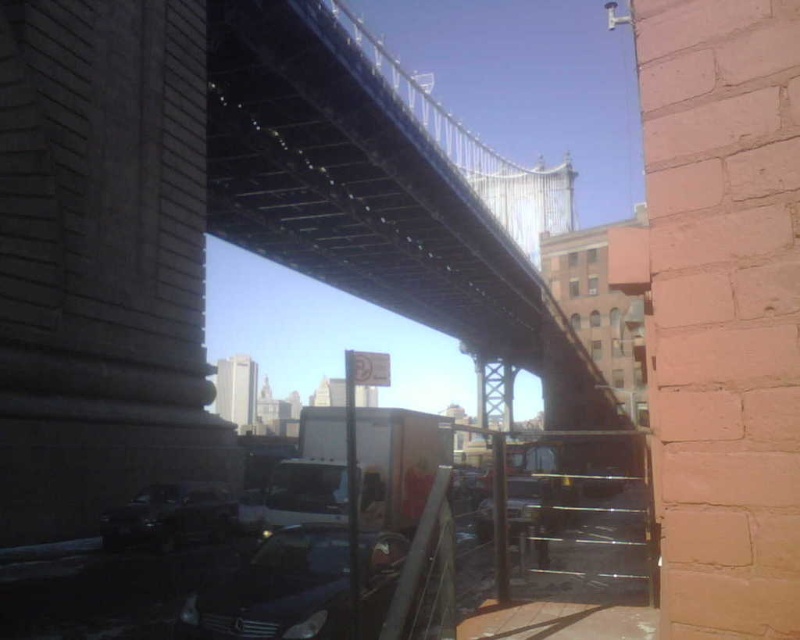
Is shiny black car at lower left to the right of metallic silver car at center from the viewer's perspective?

Incorrect, shiny black car at lower left is not on the right side of metallic silver car at center.

What do you see at coordinates (172, 516) in the screenshot? Image resolution: width=800 pixels, height=640 pixels. I see `shiny black car at lower left` at bounding box center [172, 516].

What are the coordinates of `shiny black car at lower left` in the screenshot? It's located at (172, 516).

Who is shorter, shiny black car at lower center or metallic silver car at center?

metallic silver car at center is shorter.

Is shiny black car at lower center behind metallic silver car at center?

No, it is not.

What do you see at coordinates (276, 589) in the screenshot? This screenshot has height=640, width=800. I see `shiny black car at lower center` at bounding box center [276, 589].

Where is `shiny black car at lower center`? Image resolution: width=800 pixels, height=640 pixels. shiny black car at lower center is located at coordinates (276, 589).

Is point (222, 580) positioned behind point (126, 513)?

That is False.

Is point (248, 589) positioned before point (144, 547)?

Yes, it is.

The image size is (800, 640). Find the location of `shiny black car at lower center`. shiny black car at lower center is located at coordinates (276, 589).